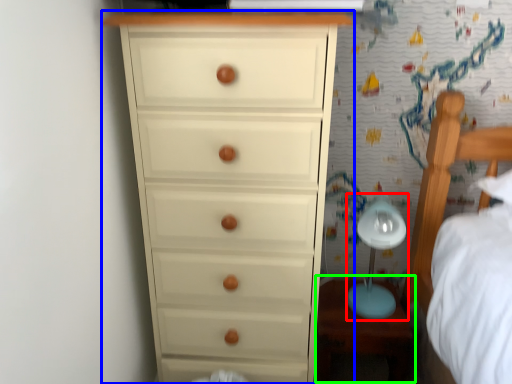
Question: Which is farther away from table lamp (highlighted by a red box)? chest of drawers (highlighted by a blue box) or table (highlighted by a green box)?

Choices:
 (A) chest of drawers
 (B) table

Answer: (A)